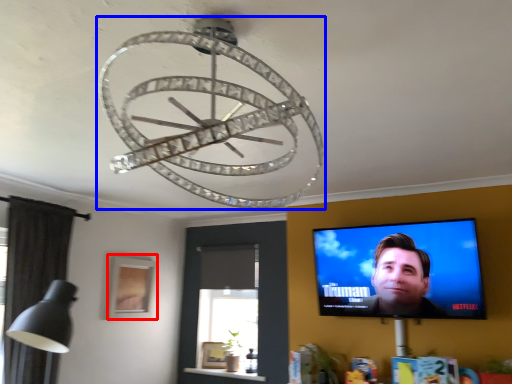
Question: Which object appears farthest to the camera in this image, picture frame (highlighted by a red box) or lamp (highlighted by a blue box)?

Choices:
 (A) picture frame
 (B) lamp

Answer: (A)